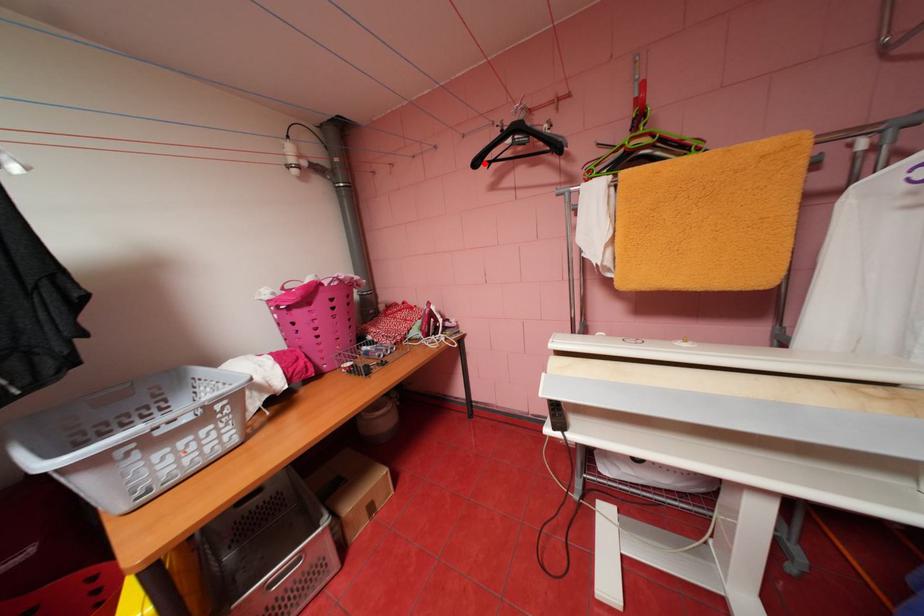
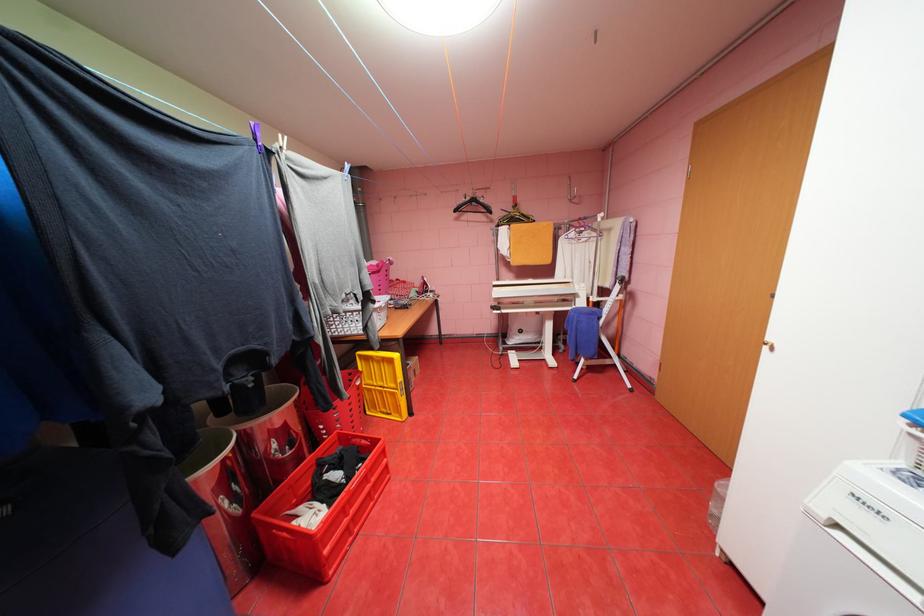
Find the pixel in the second image that matches the highlighted location in the first image.

(464, 209)